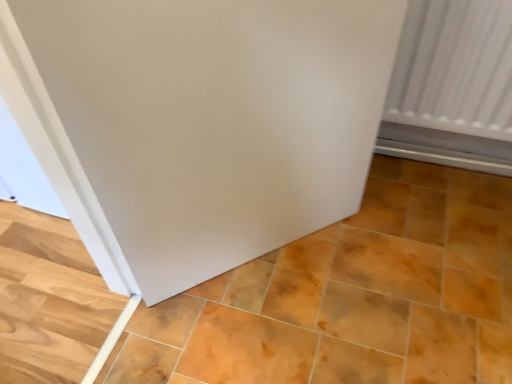
Question: From a real-world perspective, is matte orange tile at center below white matte door at center?

Choices:
 (A) no
 (B) yes

Answer: (B)

Question: Is the position of matte orange tile at center more distant than that of white matte door at center?

Choices:
 (A) no
 (B) yes

Answer: (B)

Question: Would you say white matte door at center is part of matte orange tile at center's contents?

Choices:
 (A) no
 (B) yes

Answer: (A)

Question: Can you confirm if matte orange tile at center is positioned to the right of white matte door at center?

Choices:
 (A) no
 (B) yes

Answer: (B)

Question: Is matte orange tile at center at the left side of white matte door at center?

Choices:
 (A) yes
 (B) no

Answer: (B)

Question: Considering the relative sizes of matte orange tile at center and white matte door at center in the image provided, is matte orange tile at center shorter than white matte door at center?

Choices:
 (A) yes
 (B) no

Answer: (A)

Question: Does white matte door at center have a smaller size compared to matte orange tile at center?

Choices:
 (A) yes
 (B) no

Answer: (A)

Question: Is white matte door at center not within matte orange tile at center?

Choices:
 (A) yes
 (B) no

Answer: (A)

Question: Is white matte door at center taller than matte orange tile at center?

Choices:
 (A) yes
 (B) no

Answer: (A)

Question: Is white matte door at center wider than matte orange tile at center?

Choices:
 (A) yes
 (B) no

Answer: (B)

Question: Does white matte door at center come behind matte orange tile at center?

Choices:
 (A) no
 (B) yes

Answer: (A)

Question: Does white matte door at center contain matte orange tile at center?

Choices:
 (A) no
 (B) yes

Answer: (A)

Question: Is point (401, 175) closer or farther from the camera than point (90, 205)?

Choices:
 (A) farther
 (B) closer

Answer: (A)